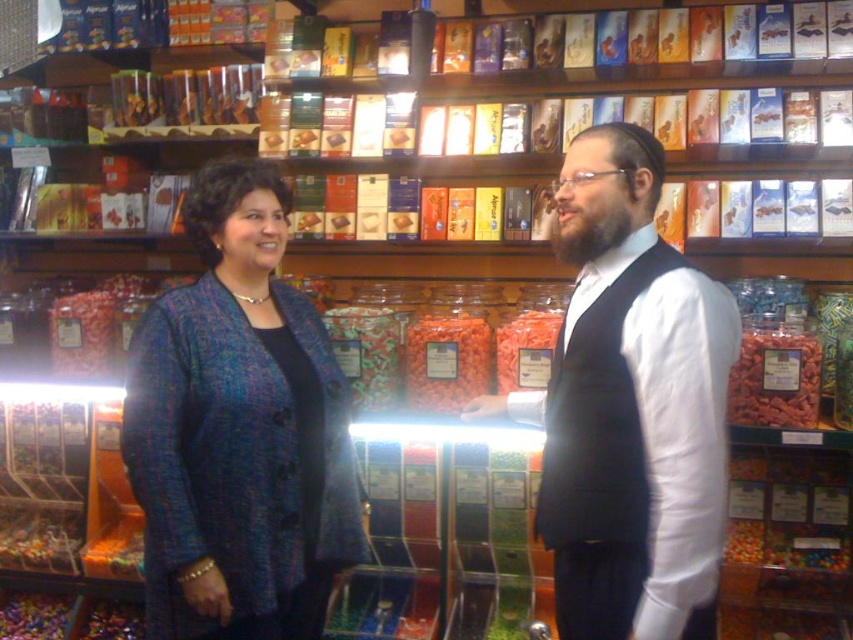
Question: Which point is farther from the camera taking this photo?

Choices:
 (A) (712, 576)
 (B) (224, 460)

Answer: (B)

Question: Can you confirm if blue textured blazer at center is wider than matte black vest at center?

Choices:
 (A) yes
 (B) no

Answer: (B)

Question: Does blue textured blazer at center lie in front of matte black vest at center?

Choices:
 (A) yes
 (B) no

Answer: (B)

Question: Among these objects, which one is farthest from the camera?

Choices:
 (A) matte black vest at center
 (B) blue textured blazer at center

Answer: (B)

Question: Is blue textured blazer at center to the right of matte black vest at center from the viewer's perspective?

Choices:
 (A) no
 (B) yes

Answer: (A)